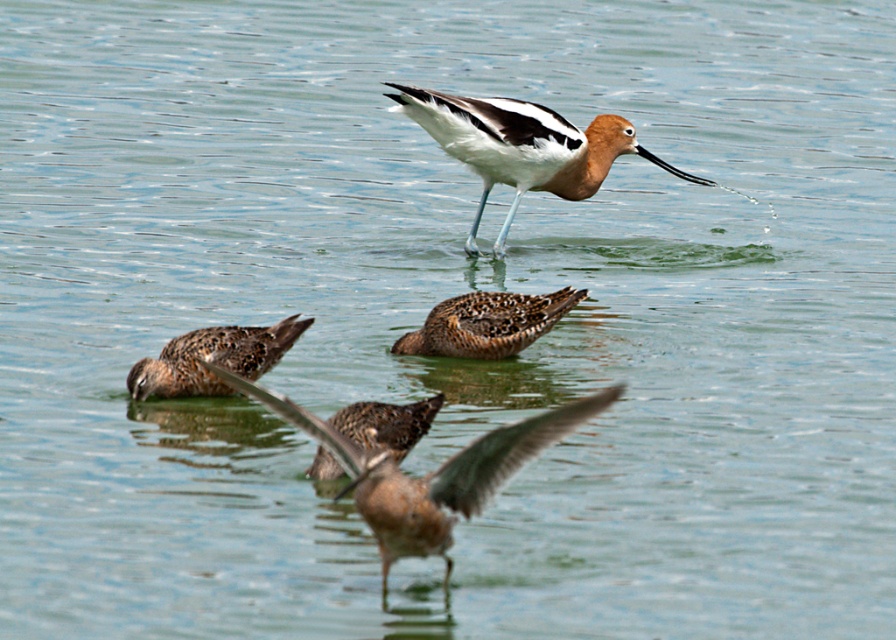
Between brown speckled duck at lower left and brown speckled duck at lower center, which one has less height?

With less height is brown speckled duck at lower center.

Is point (178, 337) positioned after point (317, 458)?

Yes, it is behind point (317, 458).

Between point (147, 387) and point (328, 422), which one is positioned in front?

Point (328, 422) is in front.

At what (x,y) coordinates should I click in order to perform the action: click on brown speckled duck at lower left. Please return your answer as a coordinate pair (x, y). Looking at the image, I should click on coord(212,358).

Find the location of a particular element. white glossy avocet at upper center is located at coordinates (522, 147).

Is white glossy avocet at upper center smaller than brown speckled duck at lower center?

Actually, white glossy avocet at upper center might be larger than brown speckled duck at lower center.

Is point (440, 99) in front of point (369, 449)?

That is False.

Locate an element on the screen. Image resolution: width=896 pixels, height=640 pixels. white glossy avocet at upper center is located at coordinates (522, 147).

Who is positioned more to the right, brown speckled bird at center or brown speckled duck at lower center?

brown speckled bird at center

Can you confirm if brown speckled bird at center is thinner than brown speckled duck at lower center?

No, brown speckled bird at center is not thinner than brown speckled duck at lower center.

Locate an element on the screen. The height and width of the screenshot is (640, 896). brown speckled bird at center is located at coordinates (427, 474).